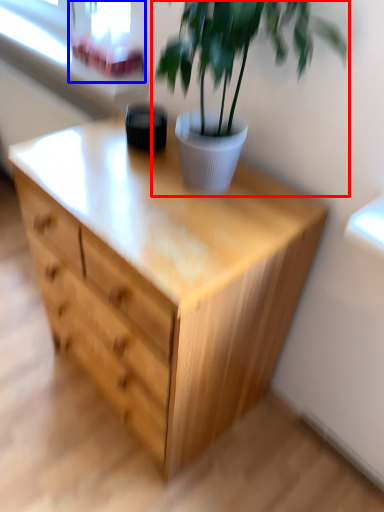
Question: Which object is closer to the camera taking this photo, houseplant (highlighted by a red box) or window screen (highlighted by a blue box)?

Choices:
 (A) houseplant
 (B) window screen

Answer: (A)